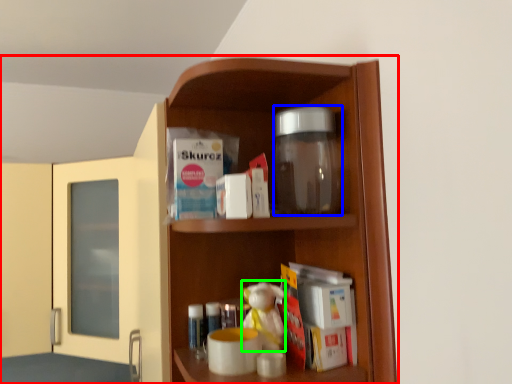
Question: Which object is positioned farthest from cupboard (highlighted by a red box)? Select from glass jar (highlighted by a blue box) and toy (highlighted by a green box).

Choices:
 (A) glass jar
 (B) toy

Answer: (B)